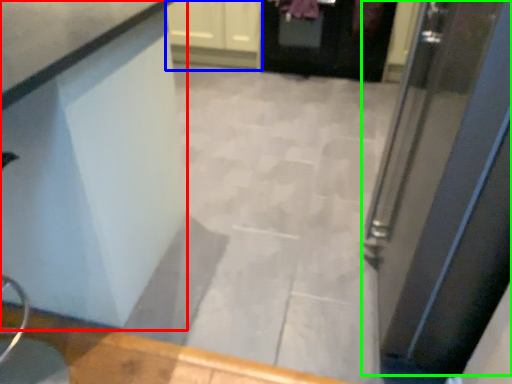
Question: Which object is the farthest from counter (highlighted by a red box)? Choose among these: cabinetry (highlighted by a blue box) or door (highlighted by a green box).

Choices:
 (A) cabinetry
 (B) door

Answer: (A)